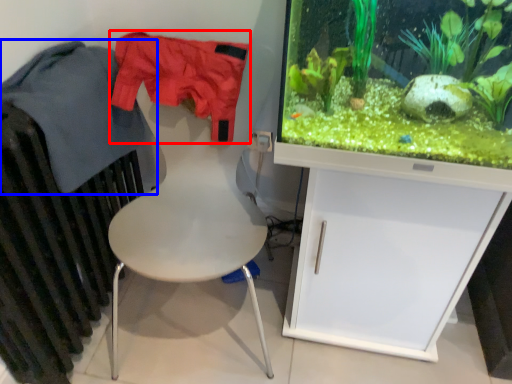
Question: Which object appears farthest to the camera in this image, clothing (highlighted by a red box) or clothing (highlighted by a blue box)?

Choices:
 (A) clothing
 (B) clothing

Answer: (A)